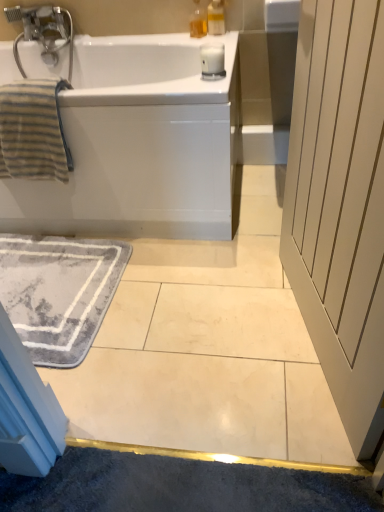
Question: Considering the relative sizes of white glossy bathtub at upper left and gray soft rug at lower left in the image provided, is white glossy bathtub at upper left thinner than gray soft rug at lower left?

Choices:
 (A) no
 (B) yes

Answer: (A)

Question: Are white glossy bathtub at upper left and gray soft rug at lower left far apart?

Choices:
 (A) no
 (B) yes

Answer: (A)

Question: Is white glossy bathtub at upper left to the left of gray soft rug at lower left from the viewer's perspective?

Choices:
 (A) yes
 (B) no

Answer: (B)

Question: Considering the relative positions of white glossy bathtub at upper left and gray soft rug at lower left in the image provided, is white glossy bathtub at upper left to the right of gray soft rug at lower left from the viewer's perspective?

Choices:
 (A) yes
 (B) no

Answer: (A)

Question: From the image's perspective, does white glossy bathtub at upper left appear higher than gray soft rug at lower left?

Choices:
 (A) no
 (B) yes

Answer: (B)

Question: Is translucent plastic soap dispenser at upper center, the 1th soap dispenser viewed from the left, bigger or smaller than translucent plastic soap dispenser at upper center, which is counted as the second soap dispenser, starting from the left?

Choices:
 (A) small
 (B) big

Answer: (A)

Question: Is translucent plastic soap dispenser at upper center, which is counted as the 2th soap dispenser, starting from the right, wider or thinner than translucent plastic soap dispenser at upper center, which is counted as the second soap dispenser, starting from the left?

Choices:
 (A) thin
 (B) wide

Answer: (A)

Question: Is translucent plastic soap dispenser at upper center, the 1th soap dispenser viewed from the left, taller or shorter than translucent plastic soap dispenser at upper center, which is counted as the second soap dispenser, starting from the left?

Choices:
 (A) short
 (B) tall

Answer: (A)

Question: Considering their positions, is translucent plastic soap dispenser at upper center, the 1th soap dispenser viewed from the left, located in front of or behind translucent plastic soap dispenser at upper center, the 1th soap dispenser from the right?

Choices:
 (A) behind
 (B) front

Answer: (A)

Question: Looking at their shapes, would you say white wood screen door at right is wider or thinner than translucent plastic soap dispenser at upper center, the 1th soap dispenser from the right?

Choices:
 (A) thin
 (B) wide

Answer: (B)

Question: Do you think white wood screen door at right is within translucent plastic soap dispenser at upper center, the 1th soap dispenser from the right, or outside of it?

Choices:
 (A) inside
 (B) outside

Answer: (B)

Question: Is white wood screen door at right taller or shorter than translucent plastic soap dispenser at upper center, the 1th soap dispenser from the right?

Choices:
 (A) short
 (B) tall

Answer: (B)

Question: Looking at the image, does white wood screen door at right seem bigger or smaller compared to translucent plastic soap dispenser at upper center, the 1th soap dispenser from the right?

Choices:
 (A) big
 (B) small

Answer: (A)

Question: Based on their positions, is white glossy bathtub at upper left located to the left or right of gray soft rug at lower left?

Choices:
 (A) left
 (B) right

Answer: (B)

Question: In terms of height, does white glossy bathtub at upper left look taller or shorter compared to gray soft rug at lower left?

Choices:
 (A) short
 (B) tall

Answer: (B)